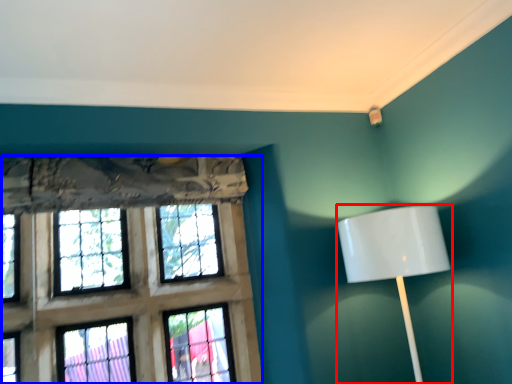
Question: Which object appears closest to the camera in this image, lamp (highlighted by a red box) or window (highlighted by a blue box)?

Choices:
 (A) lamp
 (B) window

Answer: (A)